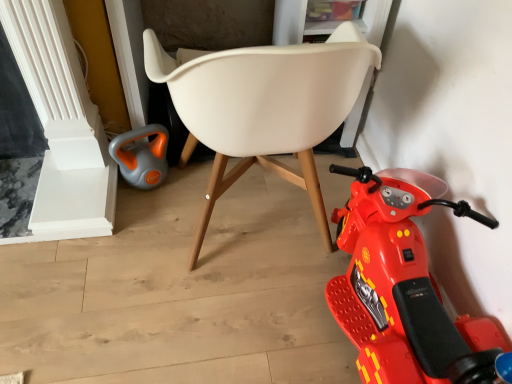
You are a GUI agent. You are given a task and a screenshot of the screen. Output one action in this format:
    pyautogui.click(x=<x>, y=<y>)
    Task: Click on the free space underneath gray-orange plastic kettle at lower left (from a real-world perspective)
    Image resolution: width=512 pixels, height=384 pixels.
    Given the screenshot: What is the action you would take?
    pyautogui.click(x=151, y=183)